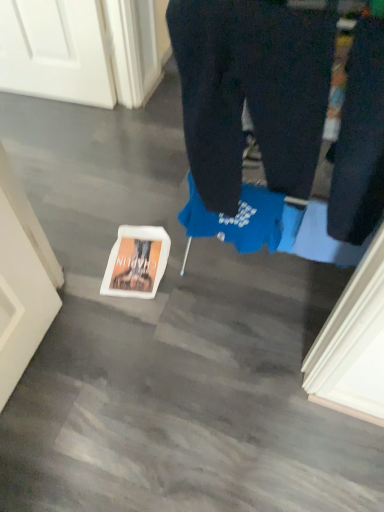
Question: Should I look upward or downward to see dark blue cotton trousers at center?

Choices:
 (A) down
 (B) up

Answer: (B)

Question: Is white matte book at lower center thinner than dark blue jeans at right?

Choices:
 (A) no
 (B) yes

Answer: (A)

Question: Does white matte book at lower center touch dark blue jeans at right?

Choices:
 (A) yes
 (B) no

Answer: (B)

Question: From the image's perspective, is white matte book at lower center below dark blue jeans at right?

Choices:
 (A) no
 (B) yes

Answer: (B)

Question: Considering the relative sizes of white matte book at lower center and dark blue jeans at right in the image provided, is white matte book at lower center wider than dark blue jeans at right?

Choices:
 (A) no
 (B) yes

Answer: (B)

Question: Considering the relative positions of white matte book at lower center and dark blue jeans at right in the image provided, is white matte book at lower center in front of dark blue jeans at right?

Choices:
 (A) no
 (B) yes

Answer: (A)

Question: Could dark blue jeans at right be considered to be inside white matte book at lower center?

Choices:
 (A) yes
 (B) no

Answer: (B)

Question: Are dark blue cotton trousers at center and dark blue jeans at right far apart?

Choices:
 (A) no
 (B) yes

Answer: (A)

Question: Does dark blue cotton trousers at center have a greater height compared to dark blue jeans at right?

Choices:
 (A) yes
 (B) no

Answer: (A)

Question: Is dark blue cotton trousers at center looking in the opposite direction of dark blue jeans at right?

Choices:
 (A) yes
 (B) no

Answer: (B)

Question: Can you confirm if dark blue cotton trousers at center is positioned to the left of dark blue jeans at right?

Choices:
 (A) yes
 (B) no

Answer: (A)

Question: Is dark blue jeans at right completely or partially inside dark blue cotton trousers at center?

Choices:
 (A) yes
 (B) no

Answer: (B)

Question: Does dark blue cotton trousers at center lie in front of dark blue jeans at right?

Choices:
 (A) yes
 (B) no

Answer: (B)

Question: Is dark blue cotton trousers at center in front of white matte book at lower center?

Choices:
 (A) yes
 (B) no

Answer: (A)